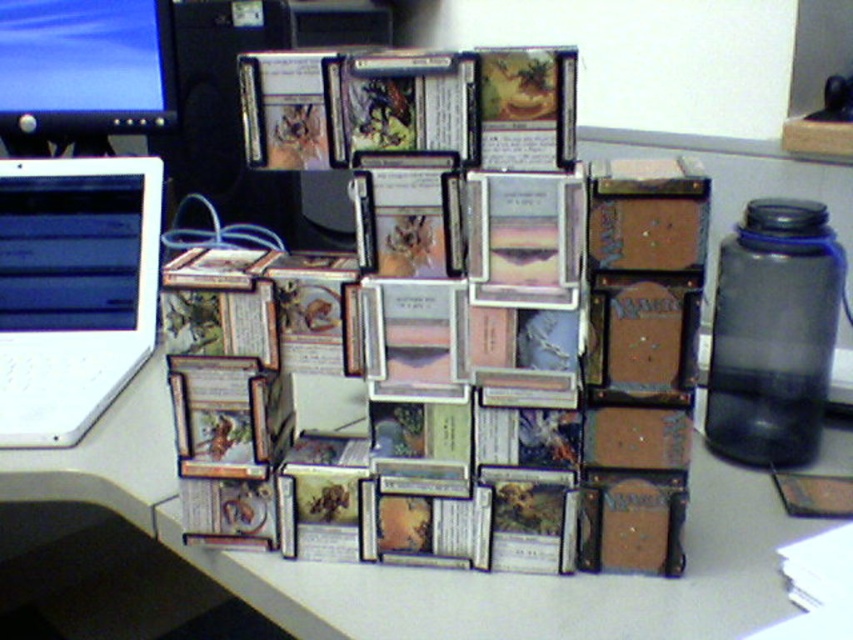
You are a game designer trying to place a new card on the smooth gray table at center. The card has a width of 2.5 inches. Can you determine if the table has enough space to accommodate the card?

The smooth gray table at center has a position at point (434, 570), but the dimensions of the table are not provided. Without knowing the table size, it is impossible to determine if the card will fit. Please provide more information about the table dimensions.

You are organizing your desk and need to move a document from the smooth gray table at center to the matte black laptop at left. Which object should you move first to create space?

You should move the smooth gray table at center first because it is closer to you than the matte black laptop at left, so moving it first will allow you to access the area behind it to reach the matte black laptop at left.

You are organizing your desk and need to move the matte black monitor at upper left and the matte black laptop at left to make space for a new printer. Which device should you move first to ensure the printer fits between them?

You should move the matte black laptop at left first because the matte black monitor at upper left is to the left of it, so moving the laptop would free up space closer to the center where the printer can be placed.